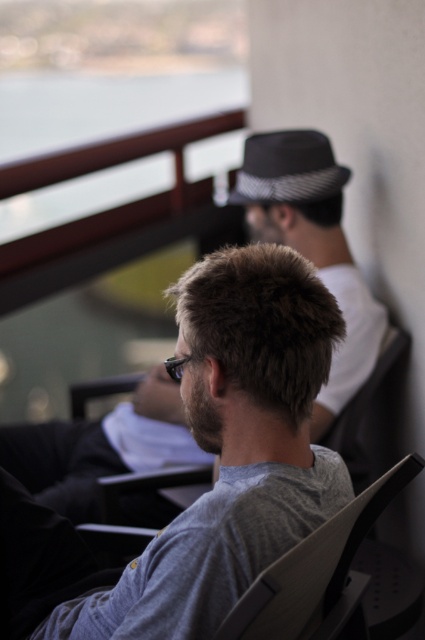
Question: Which object is the closest to the gray matte sunglasses at center?

Choices:
 (A) gray matte shirt at center
 (B) gray woolen hat at upper right

Answer: (B)

Question: Based on their relative distances, which object is farther from the gray woolen hat at upper right?

Choices:
 (A) gray matte sunglasses at center
 (B) gray matte shirt at center

Answer: (B)

Question: Is gray matte shirt at center wider than gray woolen hat at upper right?

Choices:
 (A) yes
 (B) no

Answer: (A)

Question: Which is farther from the gray matte sunglasses at center?

Choices:
 (A) gray woolen hat at upper right
 (B) gray matte shirt at center

Answer: (B)

Question: Can you confirm if gray matte shirt at center is positioned to the left of gray woolen hat at upper right?

Choices:
 (A) yes
 (B) no

Answer: (A)

Question: Does gray matte shirt at center appear over gray woolen hat at upper right?

Choices:
 (A) no
 (B) yes

Answer: (A)